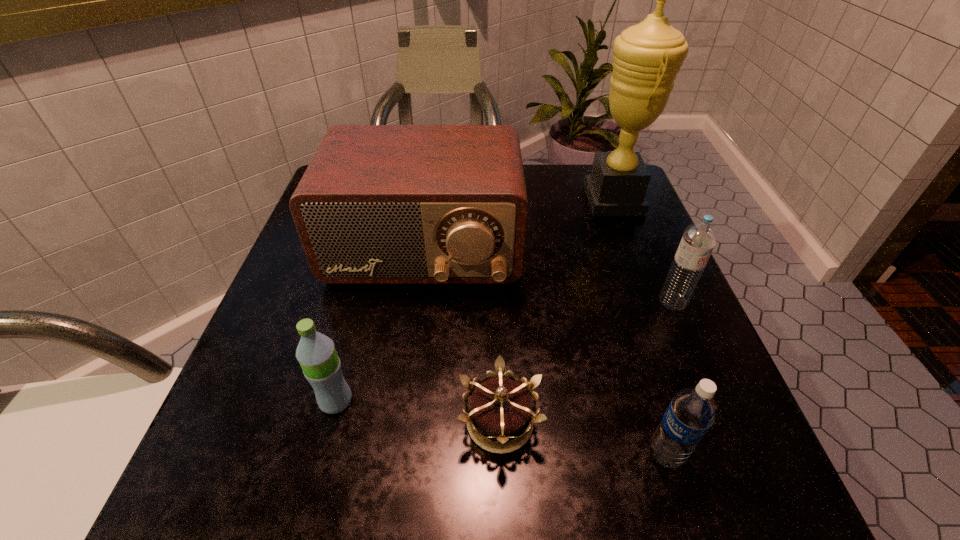
Identify the location of trophy cup. This screenshot has width=960, height=540. (647, 57).

Image resolution: width=960 pixels, height=540 pixels. In order to click on radio receiver in this screenshot , I will do `click(378, 204)`.

Identify the location of the farthest water bottle. Image resolution: width=960 pixels, height=540 pixels. (699, 238).

Locate an element on the screen. Image resolution: width=960 pixels, height=540 pixels. the second farthest water bottle is located at coordinates (321, 366).

Locate an element on the screen. The height and width of the screenshot is (540, 960). the second water bottle from left to right is located at coordinates (693, 410).

You are a GUI agent. You are given a task and a screenshot of the screen. Output one action in this format:
    pyautogui.click(x=<x>, y=<y>)
    Task: Click on the crown
    
    Given the screenshot: What is the action you would take?
    pyautogui.click(x=500, y=408)

You are a GUI agent. You are given a task and a screenshot of the screen. Output one action in this format:
    pyautogui.click(x=<x>, y=<y>)
    Task: Click on the vacant space located at the front of the tallest object with handles
    The width and height of the screenshot is (960, 540).
    Given the screenshot: What is the action you would take?
    pyautogui.click(x=525, y=200)

The image size is (960, 540). I want to click on free space located at the front of the tallest object with handles, so click(x=561, y=200).

Where is `free space located 0.050m at the front of the tallest object with handles`? free space located 0.050m at the front of the tallest object with handles is located at coordinates (565, 200).

Locate an element on the screen. Image resolution: width=960 pixels, height=540 pixels. vacant space located on the front panel of the radio receiver is located at coordinates (408, 370).